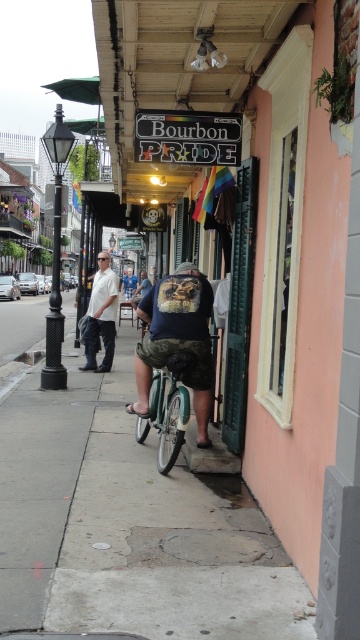
You are standing on the sidewalk in front of the Bourbon PRIDE storefront and notice two points marked on the ground. The first point is at coordinates point (x=3, y=337) and the second point is at point (x=182, y=262). Which point is closer to you?

Point (x=3, y=337) is closer to you because it is further to the viewer than point (x=182, y=262).

What is located at the coordinates point (127, 522)?

Concrete at center is located at point (127, 522).